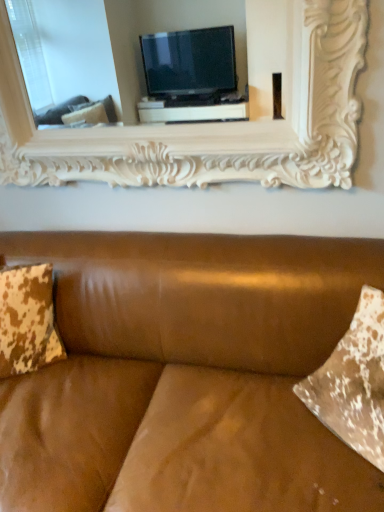
Where is `brown distressed fabric pillow at left`? This screenshot has height=512, width=384. brown distressed fabric pillow at left is located at coordinates (27, 320).

Considering the relative positions of brown leather couch at center and white carved wood picture frame at upper center in the image provided, is brown leather couch at center to the left of white carved wood picture frame at upper center from the viewer's perspective?

Correct, you'll find brown leather couch at center to the left of white carved wood picture frame at upper center.

Does brown leather couch at center turn towards white carved wood picture frame at upper center?

No.

From the image's perspective, which one is positioned higher, brown leather couch at center or white carved wood picture frame at upper center?

From the image's view, white carved wood picture frame at upper center is above.

Is brown leather couch at center located outside white carved wood picture frame at upper center?

Indeed, brown leather couch at center is completely outside white carved wood picture frame at upper center.

Does white carved wood picture frame at upper center have a lesser width compared to brown leather couch at center?

Indeed, white carved wood picture frame at upper center has a lesser width compared to brown leather couch at center.

Is brown leather couch at center at the back of white carved wood picture frame at upper center?

No, white carved wood picture frame at upper center is not facing away from brown leather couch at center.

Is white carved wood picture frame at upper center not close to brown leather couch at center?

No.

Which of these two, white carved wood picture frame at upper center or brown leather couch at center, is smaller?

white carved wood picture frame at upper center is smaller.

Can white carved wood picture frame at upper center be found inside brown distressed fabric pillow at left?

No, white carved wood picture frame at upper center is not surrounded by brown distressed fabric pillow at left.

In the image, is brown distressed fabric pillow at left on the left side or the right side of white carved wood picture frame at upper center?

From the image, it's evident that brown distressed fabric pillow at left is to the left of white carved wood picture frame at upper center.

From a real-world perspective, between brown distressed fabric pillow at left and white carved wood picture frame at upper center, who is vertically lower?

brown distressed fabric pillow at left, from a real-world perspective.

Considering the points (41, 307) and (348, 130), which point is in front, point (41, 307) or point (348, 130)?

The point (348, 130) is closer.

Which is in front, white carved wood picture frame at upper center or brown distressed fabric pillow at left?

white carved wood picture frame at upper center is closer to the camera.

How many degrees apart are the facing directions of white carved wood picture frame at upper center and brown distressed fabric pillow at left?

The facing directions of white carved wood picture frame at upper center and brown distressed fabric pillow at left are 32.7 degrees apart.

Considering the relative sizes of white carved wood picture frame at upper center and brown distressed fabric pillow at left in the image provided, is white carved wood picture frame at upper center smaller than brown distressed fabric pillow at left?

No.

Between white carved wood picture frame at upper center and brown distressed fabric pillow at left, which one has larger width?

With larger width is brown distressed fabric pillow at left.

Which of these two, brown distressed fabric pillow at left or brown leather couch at center, is bigger?

brown leather couch at center.

From a real-world perspective, who is located lower, brown distressed fabric pillow at left or brown leather couch at center?

In real-world perspective, brown leather couch at center is lower.

Is brown distressed fabric pillow at left located outside brown leather couch at center?

No, brown distressed fabric pillow at left is not entirely external to brown leather couch at center.

Does brown distressed fabric pillow at left have a greater height compared to brown leather couch at center?

Incorrect, the height of brown distressed fabric pillow at left is not larger of that of brown leather couch at center.

Is brown leather couch at center bigger or smaller than brown distressed fabric pillow at left?

Considering their sizes, brown leather couch at center takes up more space than brown distressed fabric pillow at left.

Can you tell me how much brown leather couch at center and brown distressed fabric pillow at left differ in facing direction?

The facing directions of brown leather couch at center and brown distressed fabric pillow at left are 31.8 degrees apart.

Considering the positions of objects brown leather couch at center and brown distressed fabric pillow at left in the image provided, who is more to the right, brown leather couch at center or brown distressed fabric pillow at left?

brown leather couch at center is more to the right.

The height and width of the screenshot is (512, 384). In the image, there is a white carved wood picture frame at upper center. Identify the location of studio couch below it (from the image's perspective). (185, 375).

You are a GUI agent. You are given a task and a screenshot of the screen. Output one action in this format:
    pyautogui.click(x=<x>, y=<y>)
    Task: Click on the studio couch on the left of white carved wood picture frame at upper center
    
    Given the screenshot: What is the action you would take?
    pos(185,375)

From the image, which object appears to be nearer to white carved wood picture frame at upper center, brown distressed fabric pillow at left or brown leather couch at center?

Based on the image, brown leather couch at center appears to be nearer to white carved wood picture frame at upper center.

Based on their spatial positions, is white carved wood picture frame at upper center or brown leather couch at center closer to brown distressed fabric pillow at left?

brown leather couch at center.

When comparing their distances from brown distressed fabric pillow at left, does brown leather couch at center or white carved wood picture frame at upper center seem closer?

The object closer to brown distressed fabric pillow at left is brown leather couch at center.

Looking at the image, which one is located closer to white carved wood picture frame at upper center, brown leather couch at center or brown distressed fabric pillow at left?

The object closer to white carved wood picture frame at upper center is brown leather couch at center.

In the scene shown: When comparing their distances from brown leather couch at center, does white carved wood picture frame at upper center or brown distressed fabric pillow at left seem further?

Based on the image, white carved wood picture frame at upper center appears to be further to brown leather couch at center.

From the image, which object appears to be nearer to brown leather couch at center, brown distressed fabric pillow at left or white carved wood picture frame at upper center?

brown distressed fabric pillow at left.

Find the location of a particular element. The height and width of the screenshot is (512, 384). pillow between white carved wood picture frame at upper center and brown leather couch at center vertically is located at coordinates (27, 320).